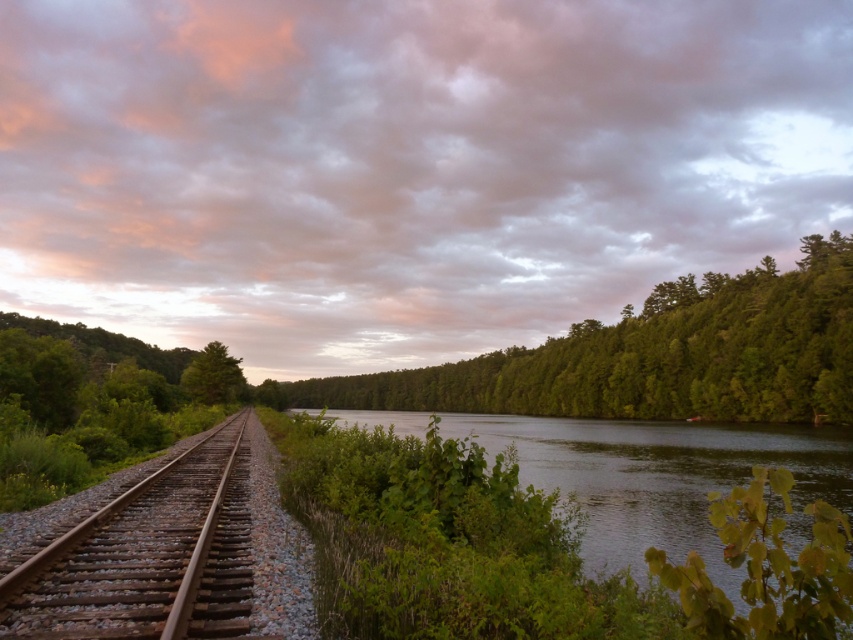
Question: Does brown gravel train track at center appear over green matte tree at center?

Choices:
 (A) yes
 (B) no

Answer: (A)

Question: Which object is positioned farthest from the green leafy river at center?

Choices:
 (A) green leafy trees at center
 (B) green matte tree at center

Answer: (A)

Question: Is brown gravel train track at center below green matte tree at center?

Choices:
 (A) no
 (B) yes

Answer: (A)

Question: Which point is closer to the camera taking this photo?

Choices:
 (A) (608, 582)
 (B) (15, 630)
 (C) (802, 380)

Answer: (B)

Question: Does green leafy river at center appear over green leafy trees at center?

Choices:
 (A) no
 (B) yes

Answer: (B)

Question: Which object is closer to the camera taking this photo?

Choices:
 (A) green leafy river at center
 (B) green matte tree at center
 (C) green leafy trees at center

Answer: (A)